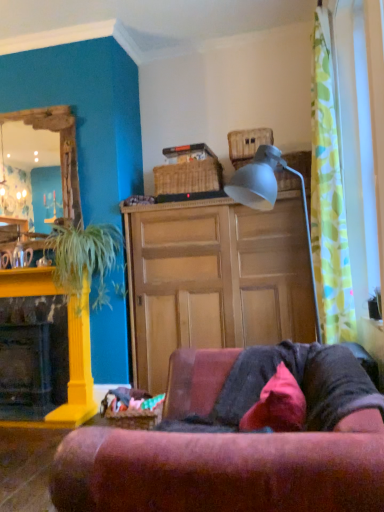
Identify the location of vacant space underneath wooden mirror at left (from a real-world perspective). (35, 269).